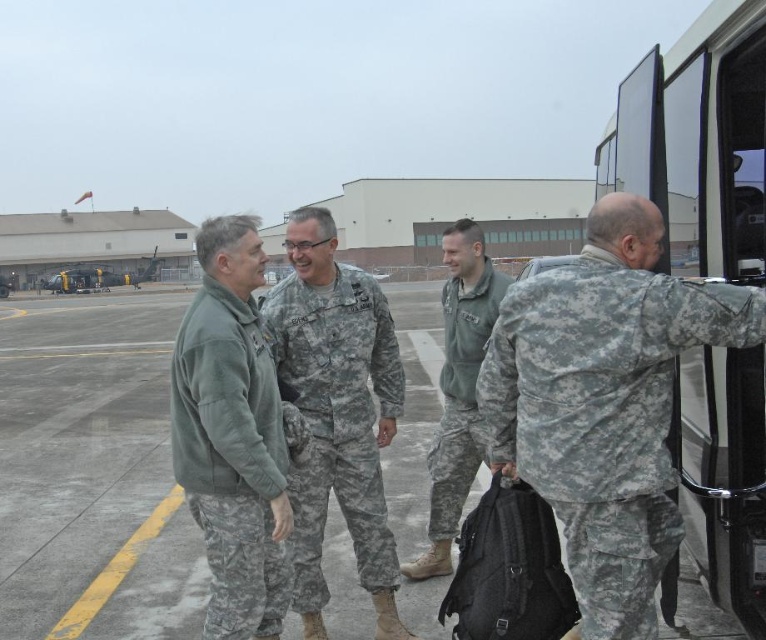
You are a photographer positioned at the center of the airfield. You need to take a photo that includes both the camouflage uniform at right and the camouflage fabric uniform at center. Which direction should you face to ensure both are in the frame?

You should face to the left to include both the camouflage uniform at right and the camouflage fabric uniform at center in the frame, since the camouflage uniform at right is positioned to the right of the camouflage fabric uniform at center.